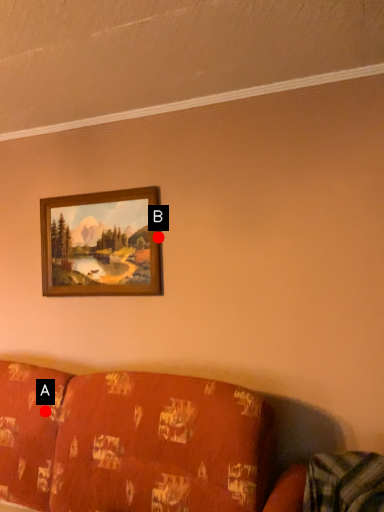
Question: Two points are circled on the image, labeled by A and B beside each circle. Which of the following is the closest to the observer?

Choices:
 (A) A is closer
 (B) B is closer

Answer: (A)